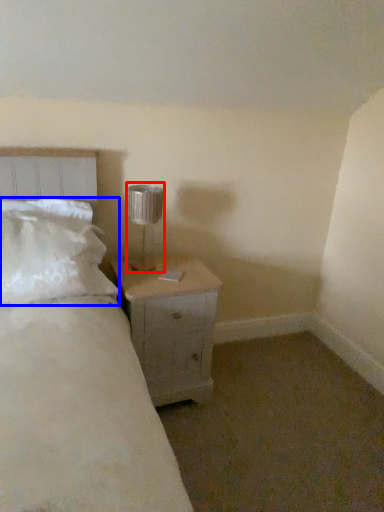
Question: Which of the following is the farthest to the observer, lamp (highlighted by a red box) or pillow (highlighted by a blue box)?

Choices:
 (A) lamp
 (B) pillow

Answer: (A)